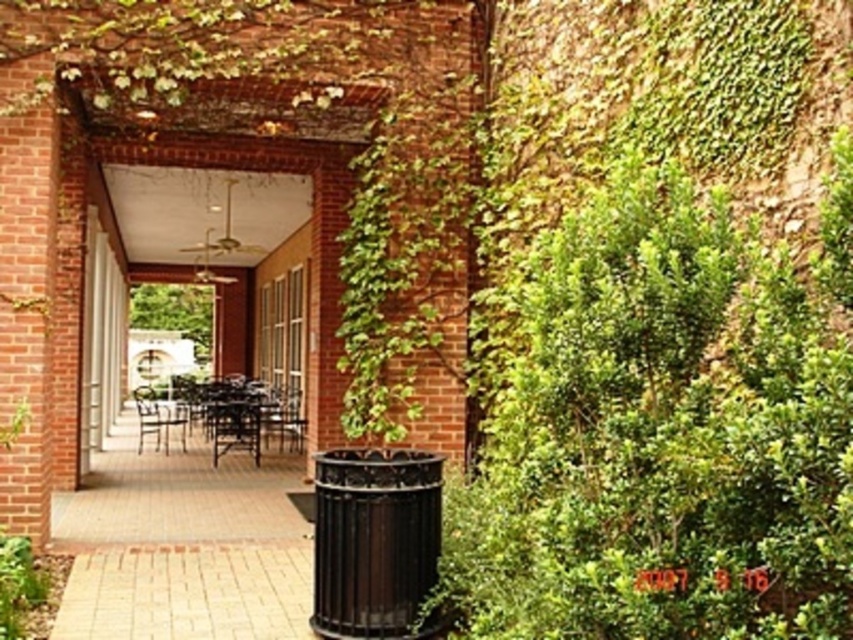
You are a maintenance worker who needs to move a 4.5 feet wide equipment between the metallic black chair at center and the metallic brown chair at center. Can you fit the equipment between them without moving either chair?

The metallic black chair at center and metallic brown chair at center are 6.63 feet apart. Since the equipment is 4.5 feet wide, it can fit between them as the distance is greater than the equipment width.

Consider the image. You are standing at the entrance of the courtyard and want to place a metallic black chair at center in a specific location. According to the coordinates provided, where should you place it?

The metallic black chair at center should be placed at point (x=283, y=417).

You are standing in the courtyard and want to place a small decoration between the two points, point (x=291, y=417) and point (x=154, y=419). Which point should you place it closer to if you want the decoration to be more visible from your current position?

You should place the decoration closer to point (x=291, y=417) because it is closer to the camera, making it more visible from your current position.